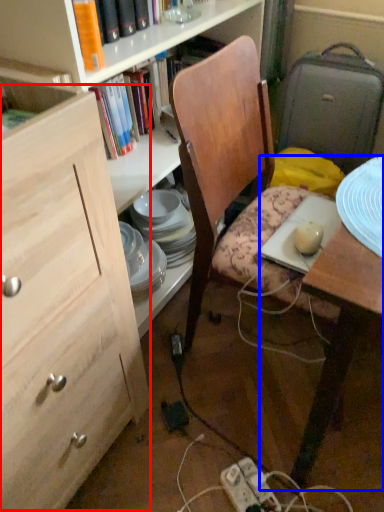
Question: Which of the following is the closest to the observer, cabinetry (highlighted by a red box) or desk (highlighted by a blue box)?

Choices:
 (A) cabinetry
 (B) desk

Answer: (A)